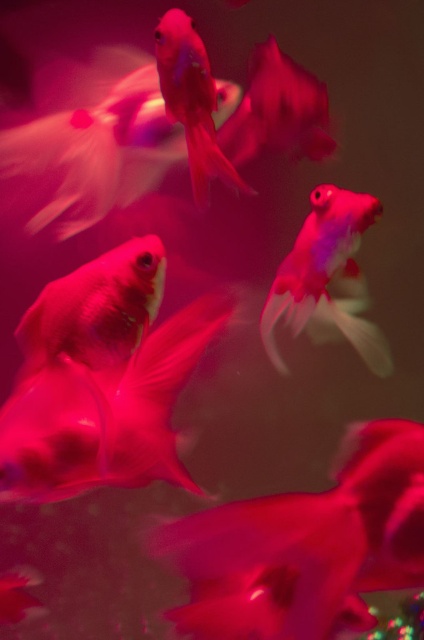
Is point (346, 465) behind point (164, 44)?

That is False.

Which is behind, point (423, 577) or point (178, 120)?

Positioned behind is point (178, 120).

Where is `translucent pinkish-gold at center`? translucent pinkish-gold at center is located at coordinates click(x=306, y=547).

Is translucent pink goldfish at center to the left of matte pink goldfish at upper center from the viewer's perspective?

Incorrect, translucent pink goldfish at center is not on the left side of matte pink goldfish at upper center.

Which of these two, translucent pink goldfish at center or matte pink goldfish at upper center, stands shorter?

matte pink goldfish at upper center is shorter.

In order to click on translucent pink goldfish at center in this screenshot , I will do `click(326, 276)`.

Where is `translucent pink goldfish at center`? The image size is (424, 640). translucent pink goldfish at center is located at coordinates (326, 276).

Can you confirm if translucent pinkish-gold at center is positioned below translucent pink goldfish at center?

Yes.

Where is `translucent pinkish-gold at center`? translucent pinkish-gold at center is located at coordinates (306, 547).

At what (x,y) coordinates should I click in order to perform the action: click on translucent pinkish-gold at center. Please return your answer as a coordinate pair (x, y). Looking at the image, I should click on (306, 547).